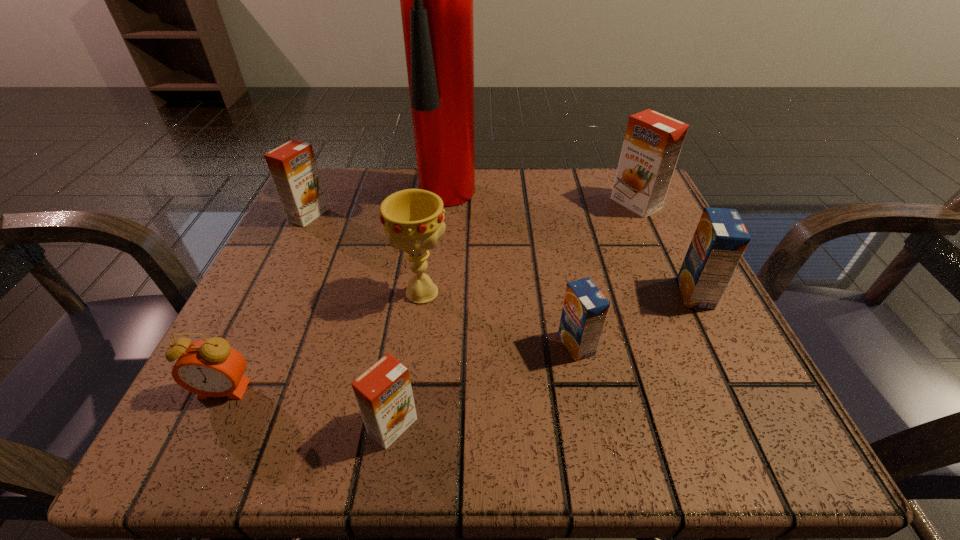
Where is `free space located 0.290m on the left of the left blue orange_juice`? This screenshot has height=540, width=960. free space located 0.290m on the left of the left blue orange_juice is located at coordinates (362, 345).

Locate an element on the screen. vacant space positioned on the right of the second orange orange juice from right to left is located at coordinates (488, 426).

The image size is (960, 540). Find the location of `fire extinguisher that is at the far edge`. fire extinguisher that is at the far edge is located at coordinates (436, 0).

Locate an element on the screen. alarm clock located at the near edge is located at coordinates (211, 368).

Where is `orange juice that is at the near edge`? This screenshot has width=960, height=540. orange juice that is at the near edge is located at coordinates (384, 395).

Image resolution: width=960 pixels, height=540 pixels. What are the coordinates of `orange juice that is at the left edge` in the screenshot? It's located at (293, 168).

The width and height of the screenshot is (960, 540). In order to click on alarm clock present at the left edge in this screenshot , I will do `click(211, 368)`.

This screenshot has height=540, width=960. I want to click on object present at the far left corner, so click(293, 168).

At what (x,y) coordinates should I click in order to perform the action: click on object that is positioned at the near left corner. Please return your answer as a coordinate pair (x, y). Looking at the image, I should click on (211, 368).

The height and width of the screenshot is (540, 960). In order to click on object that is positioned at the far right corner in this screenshot , I will do `click(652, 143)`.